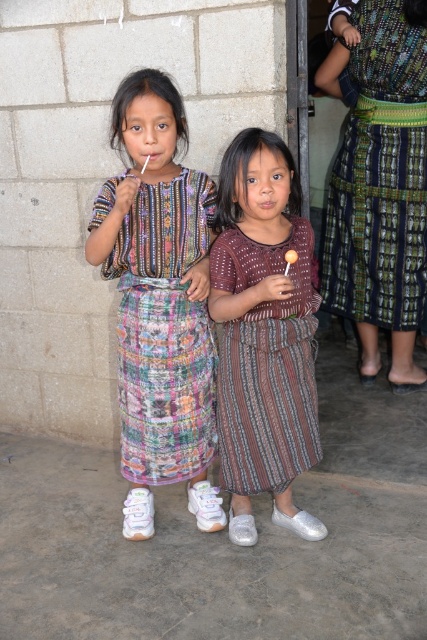
You are a photographer trying to capture a group photo of the two girls. You notice that the green and blue woven skirt at right and the brown striped dress at center are overlapping slightly. Which girl should you ask to move to the left to avoid overlapping?

The green and blue woven skirt at right is wider than the brown striped dress at center, so you should ask the girl wearing the green and blue woven skirt at right to move to the left to avoid overlapping.

You are a photographer trying to capture a group photo of the two girls. You need to ensure that both dresses are visible in the frame. Given that the multicolored woven dress at center and the brown striped dress at center are different in height, which dress should you position closer to the camera to avoid it being cropped out?

The multicolored woven dress at center is taller than the brown striped dress at center. To prevent the taller dress from being cropped out, position the multicolored woven dress at center closer to the camera so it fits within the frame.